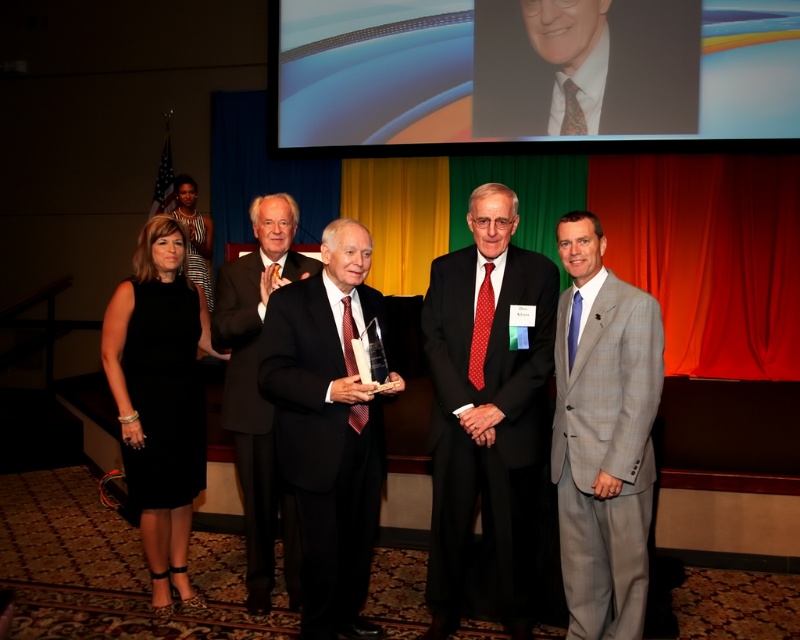
You are an event planner organizing a photo shoot for the award ceremony. You need to arrange the two individuals wearing the gray checkered suit at right and the black satin suit at center in a line for a group photo. Which individual should stand closer to the camera to ensure their suits are visible in the photo?

The gray checkered suit at right is smaller than the black satin suit at center. To ensure visibility, the gray checkered suit at right should stand closer to the camera so it appears larger in the photo, balancing the sizes of both suits.

You are an event planner organizing a photoshoot for the award ceremony. You need to ensure that the black silk suit at center and the black suit at center are positioned so that the shorter one is in the front. Which suit should be placed in front?

The black silk suit at center is shorter than the black suit at center, so the black silk suit at center should be placed in front to ensure it is visible.